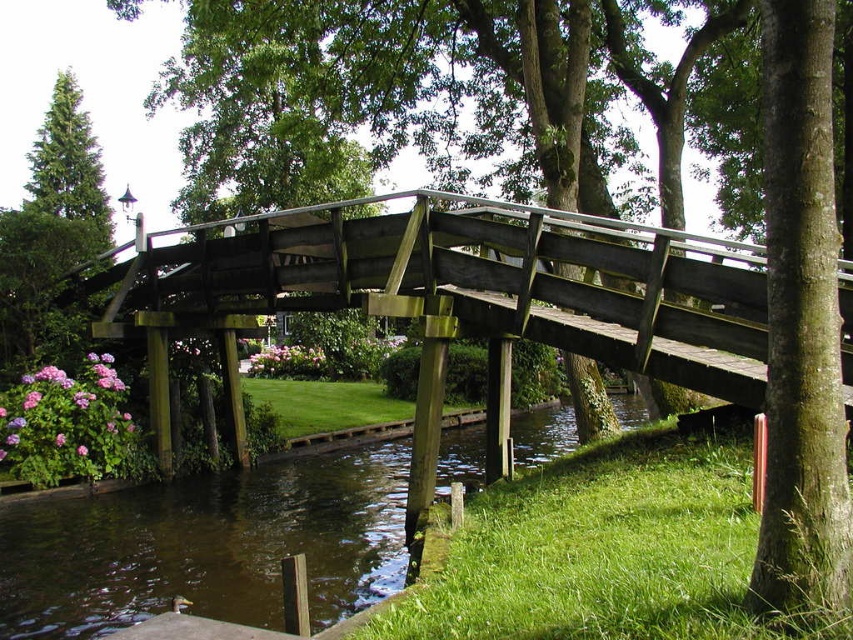
Does brown wooden river at lower left have a lesser width compared to green matte tree at upper left?

Correct, brown wooden river at lower left's width is less than green matte tree at upper left's.

Who is more forward, (x=239, y=502) or (x=1, y=236)?

Positioned in front is point (x=239, y=502).

I want to click on brown wooden river at lower left, so click(207, 547).

Between point (833, 360) and point (7, 234), which one is positioned behind?

Positioned behind is point (7, 234).

Who is more forward, (772, 140) or (96, 156)?

Point (772, 140)

Is point (776, 588) positioned after point (16, 234)?

That is False.

The image size is (853, 640). What are the coordinates of `smooth brown tree trunk at right` in the screenshot? It's located at (801, 323).

Describe the element at coordinates (462, 284) in the screenshot. I see `wooden bridge at center` at that location.

Between wooden bridge at center and smooth brown tree trunk at right, which one appears on the right side from the viewer's perspective?

Positioned to the right is smooth brown tree trunk at right.

The height and width of the screenshot is (640, 853). I want to click on wooden bridge at center, so click(x=462, y=284).